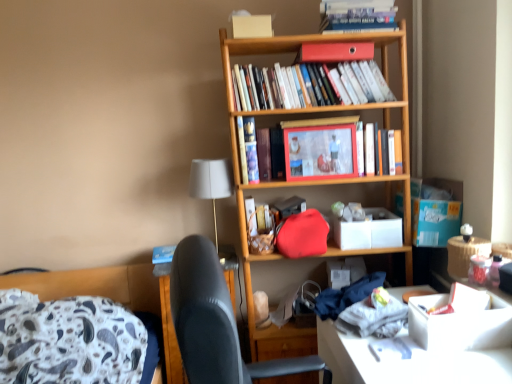
Question: Should I look upward or downward to see hardcover book at center, which is the second book from bottom to top?

Choices:
 (A) up
 (B) down

Answer: (A)

Question: Can you confirm if white fabric lampshade at upper center is taller than hardcover book at center, the 3th book positioned from the top?

Choices:
 (A) no
 (B) yes

Answer: (B)

Question: Can you confirm if white fabric lampshade at upper center is positioned to the right of hardcover book at center, the 3th book positioned from the top?

Choices:
 (A) yes
 (B) no

Answer: (B)

Question: Is white fabric lampshade at upper center with hardcover book at center, which is the second book from bottom to top?

Choices:
 (A) yes
 (B) no

Answer: (B)

Question: Could you tell me if white fabric lampshade at upper center is turned towards hardcover book at center, which is the second book from bottom to top?

Choices:
 (A) no
 (B) yes

Answer: (A)

Question: Considering the relative sizes of white fabric lampshade at upper center and hardcover book at center, the 3th book positioned from the top, in the image provided, is white fabric lampshade at upper center shorter than hardcover book at center, the 3th book positioned from the top,?

Choices:
 (A) yes
 (B) no

Answer: (B)

Question: From the image's perspective, does white fabric lampshade at upper center appear lower than hardcover book at center, which is the second book from bottom to top?

Choices:
 (A) no
 (B) yes

Answer: (B)

Question: Is matte red handbag at center a part of hardcover book at center, which is the second book from bottom to top?

Choices:
 (A) no
 (B) yes

Answer: (A)

Question: From a real-world perspective, is hardcover book at center, the 3th book positioned from the top, beneath matte red handbag at center?

Choices:
 (A) yes
 (B) no

Answer: (B)

Question: From a real-world perspective, is hardcover book at center, the 3th book positioned from the top, on matte red handbag at center?

Choices:
 (A) yes
 (B) no

Answer: (A)

Question: Does hardcover book at center, which is the second book from bottom to top, turn towards matte red handbag at center?

Choices:
 (A) yes
 (B) no

Answer: (B)

Question: From the image's perspective, is hardcover book at center, which is the second book from bottom to top, under matte red handbag at center?

Choices:
 (A) no
 (B) yes

Answer: (A)

Question: From the image's perspective, is hardcover book at center, which is the second book from bottom to top, above matte red handbag at center?

Choices:
 (A) yes
 (B) no

Answer: (A)

Question: Would you consider hardcover book at center, the 1th book from the bottom, to be distant from matte red handbag at center?

Choices:
 (A) yes
 (B) no

Answer: (B)